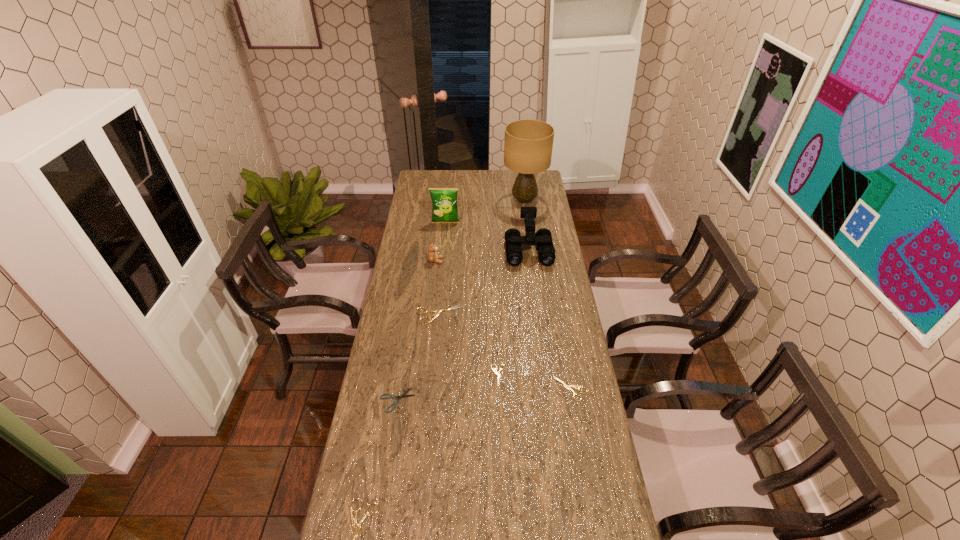
Identify the location of the tallest object. This screenshot has height=540, width=960. (528, 144).

You are a GUI agent. You are given a task and a screenshot of the screen. Output one action in this format:
    pyautogui.click(x=<x>, y=<y>)
    Task: Click on the beige lampshade
    The image size is (960, 540).
    Given the screenshot: What is the action you would take?
    pyautogui.click(x=528, y=144)

At what (x,y) coordinates should I click in order to perform the action: click on green crisp (potato chip). Please return your answer as a coordinate pair (x, y). Looking at the image, I should click on (444, 200).

At what (x,y) coordinates should I click in order to perform the action: click on the eighth shortest object. Please return your answer as a coordinate pair (x, y). Looking at the image, I should click on (444, 200).

Locate an element on the screen. The width and height of the screenshot is (960, 540). binoculars is located at coordinates (543, 238).

Image resolution: width=960 pixels, height=540 pixels. I want to click on the sixth shortest object, so click(x=433, y=257).

Where is `the fifth farthest object`? This screenshot has width=960, height=540. the fifth farthest object is located at coordinates (436, 312).

I want to click on the farthest shears, so click(x=436, y=312).

Identify the location of the rightmost shears. (569, 387).

The width and height of the screenshot is (960, 540). Identify the location of the third shortest object. (569, 387).